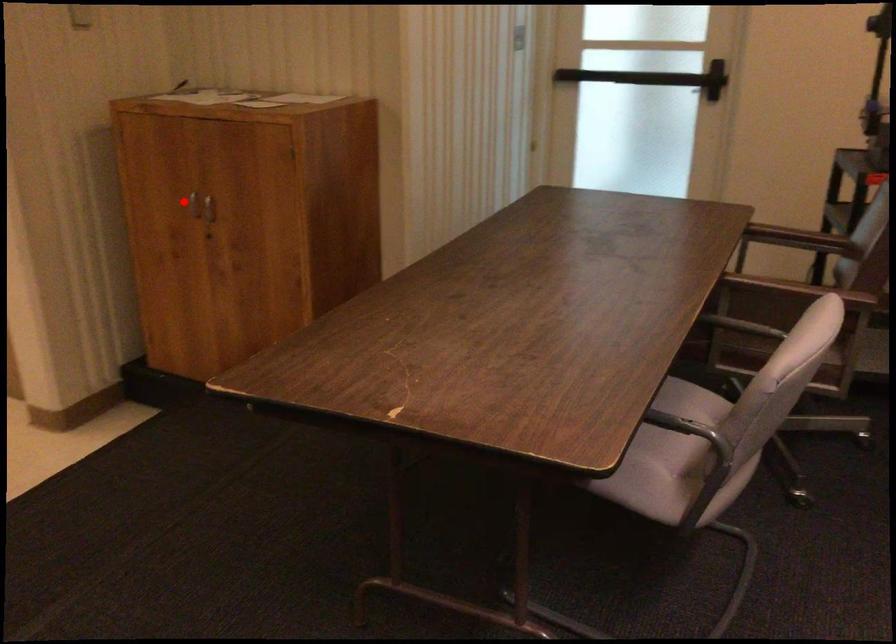
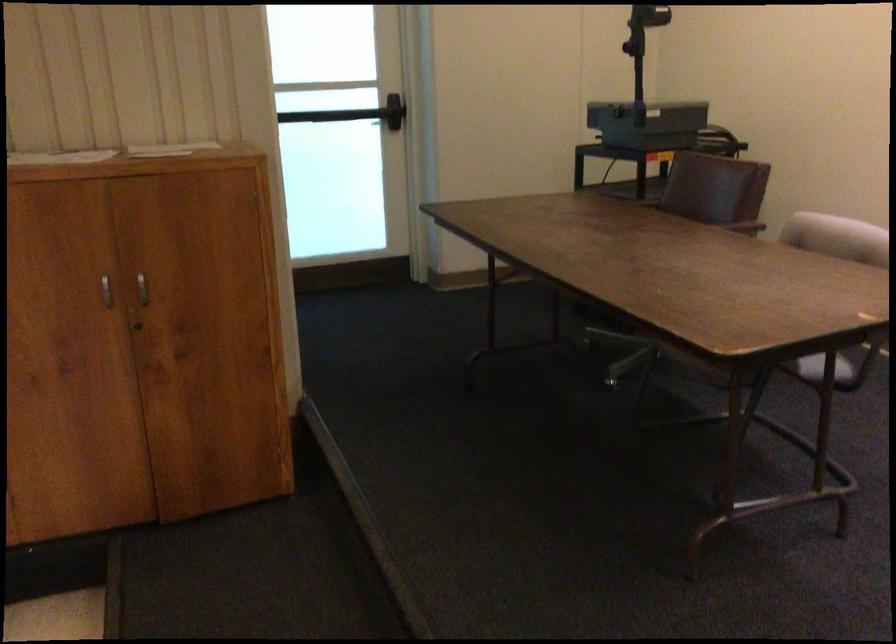
Question: I am providing you with two images of the same scene from different viewpoints. In image1, a red point is highlighted. Considering the same 3D point in image2, which of the following is correct?

Choices:
 (A) It is closer
 (B) It is farther

Answer: (A)